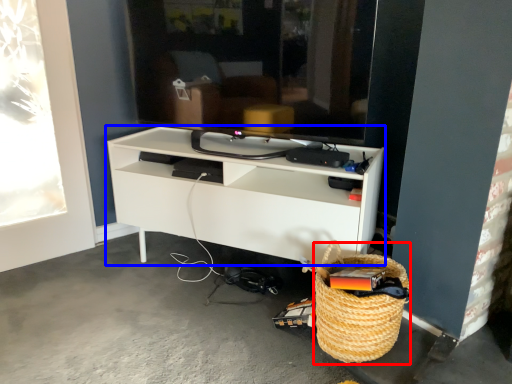
Question: Which point is further to the camera, basket (highlighted by a red box) or shelf (highlighted by a blue box)?

Choices:
 (A) basket
 (B) shelf

Answer: (B)